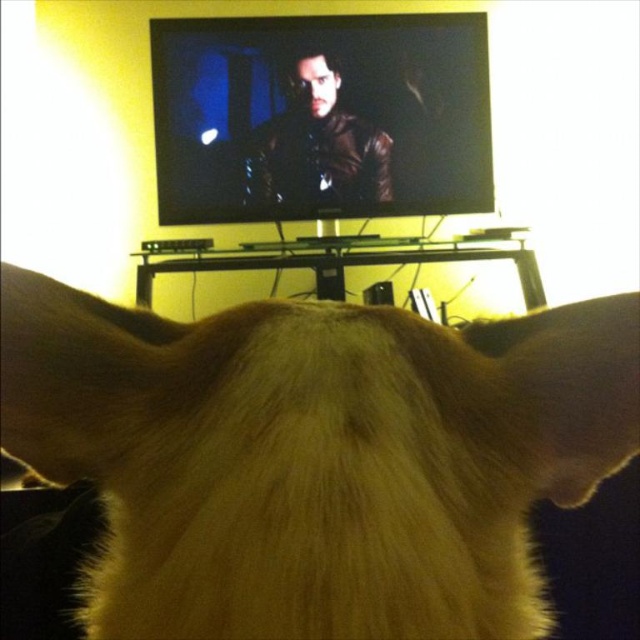
Question: Which object is positioned closest to the matte black nose at upper center?

Choices:
 (A) brown fur at center
 (B) matte brown leather jacket at upper center

Answer: (B)

Question: Which object is positioned farthest from the black glass entertainment center at center?

Choices:
 (A) matte black nose at upper center
 (B) brown fur at center

Answer: (B)

Question: Is brown fur at center below matte black nose at upper center?

Choices:
 (A) yes
 (B) no

Answer: (A)

Question: Does brown fur at center come behind matte brown leather jacket at upper center?

Choices:
 (A) no
 (B) yes

Answer: (A)

Question: Which point is closer to the camera taking this photo?

Choices:
 (A) (221, 417)
 (B) (336, 93)
 (C) (141, 275)

Answer: (A)

Question: Does black glass entertainment center at center come behind matte black nose at upper center?

Choices:
 (A) no
 (B) yes

Answer: (A)